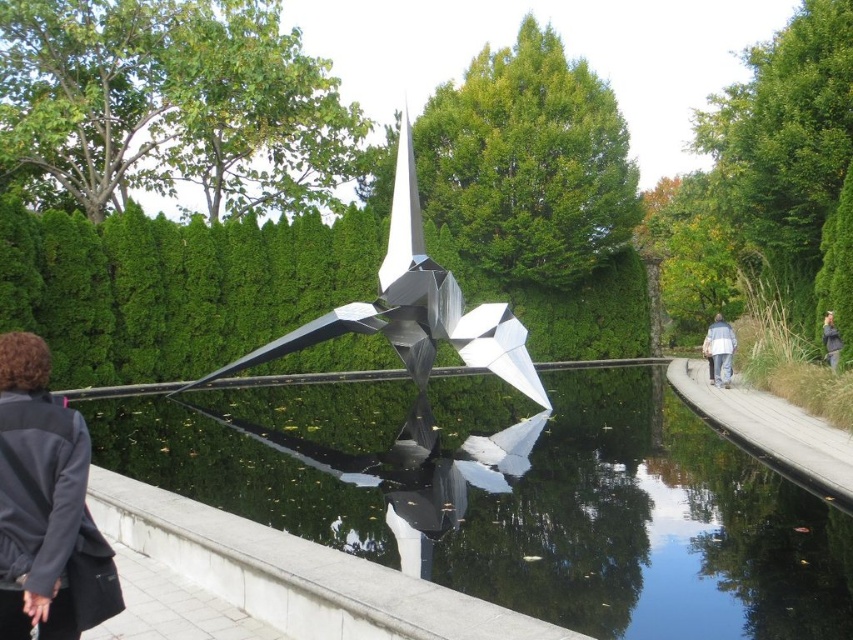
Question: Which object is closer to the camera taking this photo?

Choices:
 (A) gray fabric jacket at upper right
 (B) transparent glass water at center

Answer: (B)

Question: Which point appears closest to the camera in this image?

Choices:
 (A) (x=833, y=340)
 (B) (x=701, y=346)
 (C) (x=666, y=365)

Answer: (A)

Question: Which object is positioned farthest from the metallic silver sculpture at center?

Choices:
 (A) white cotton jacket at right
 (B) transparent glass water at center
 (C) dark gray jacket at lower left
 (D) gray fabric jacket at upper right

Answer: (C)

Question: Does transparent glass water at center have a lesser width compared to metallic silver sculpture at center?

Choices:
 (A) yes
 (B) no

Answer: (B)

Question: Can you confirm if transparent glass water at center is positioned above gray fabric jacket at upper right?

Choices:
 (A) yes
 (B) no

Answer: (B)

Question: Is dark gray jacket at lower left closer to camera compared to wooden pathway at right?

Choices:
 (A) no
 (B) yes

Answer: (B)